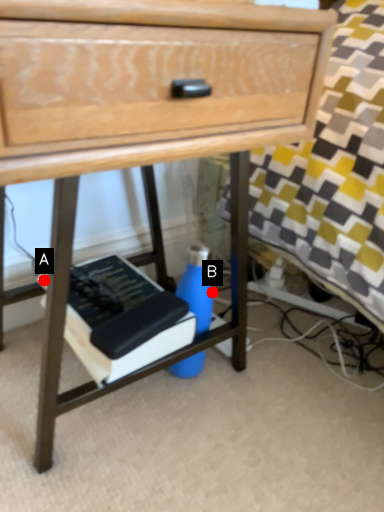
Question: Two points are circled on the image, labeled by A and B beside each circle. Which point appears farthest from the camera in this image?

Choices:
 (A) A is further
 (B) B is further

Answer: (B)